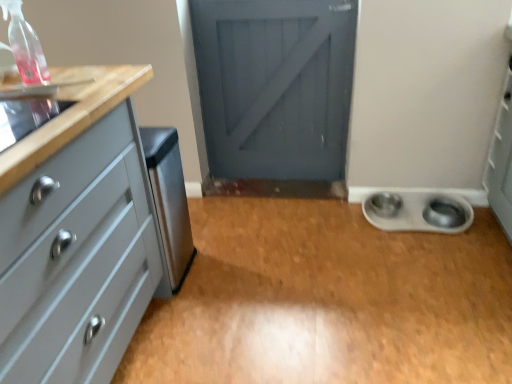
Identify the location of free point to the left of metallic silver bowl at lower right. The image size is (512, 384). (348, 215).